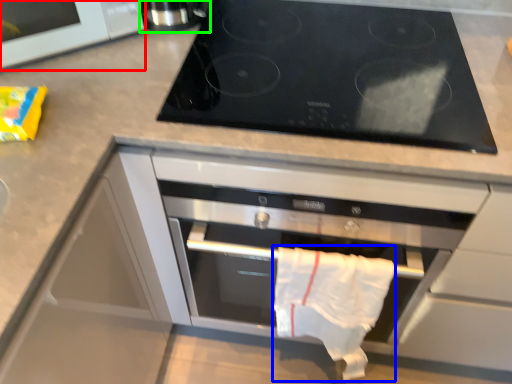
Question: Which is farther away from microwave (highlighted by a red box)? cloth (highlighted by a blue box) or appliance (highlighted by a green box)?

Choices:
 (A) cloth
 (B) appliance

Answer: (A)